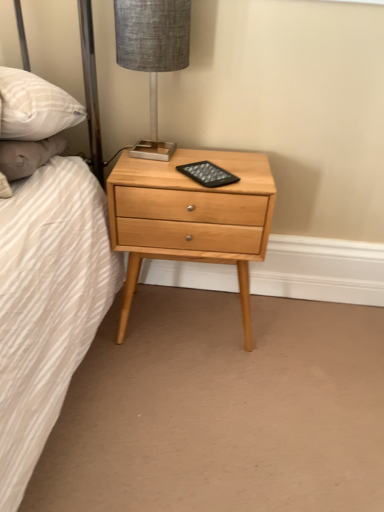
The image size is (384, 512). Identify the location of blank space above natural wood nightstand at center (from a real-world perspective). (188, 164).